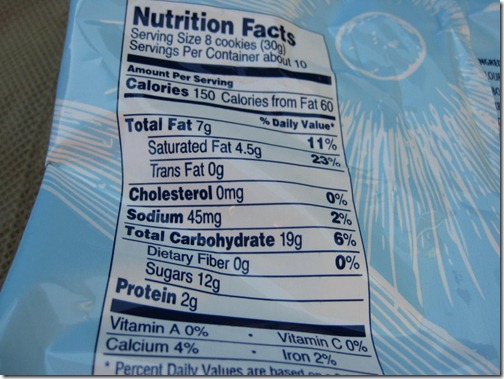
The width and height of the screenshot is (504, 379). In order to click on bar in this screenshot , I will do [216, 315].